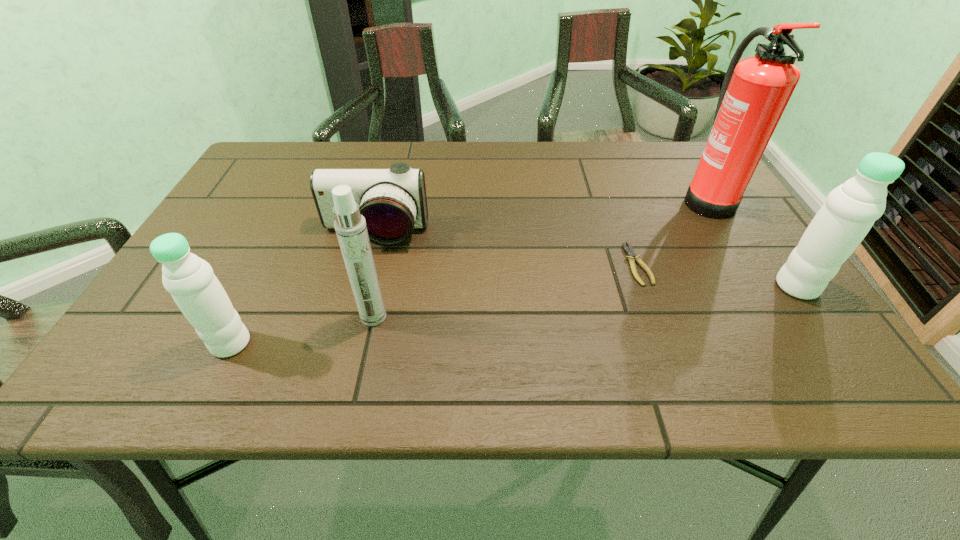
You are a GUI agent. You are given a task and a screenshot of the screen. Output one action in this format:
    pyautogui.click(x=<x>, y=<y>)
    Task: Click on the free spot between the shorter water bottle and the farther water bottle
    This screenshot has height=540, width=960.
    Given the screenshot: What is the action you would take?
    pyautogui.click(x=514, y=315)

Locate an element on the screen. The height and width of the screenshot is (540, 960). vacant space that's between the nearer water bottle and the second nearest object is located at coordinates click(x=302, y=330).

Identify the location of object that is the fourth nearest to the taller water bottle. (350, 226).

Identify the location of the fifth closest object to the shorter water bottle. The image size is (960, 540). (850, 210).

In order to click on vacant space that satisfies the following two spatial constraints: 1. on the back side of the farther water bottle; 2. on the left side of the shorter water bottle in this screenshot , I will do `click(259, 287)`.

At what (x,y) coordinates should I click in order to perform the action: click on free spot that satisfies the following two spatial constraints: 1. at the nozzle of the tallest object; 2. on the front side of the nearest object. Please return your answer as a coordinate pair (x, y). Looking at the image, I should click on (797, 343).